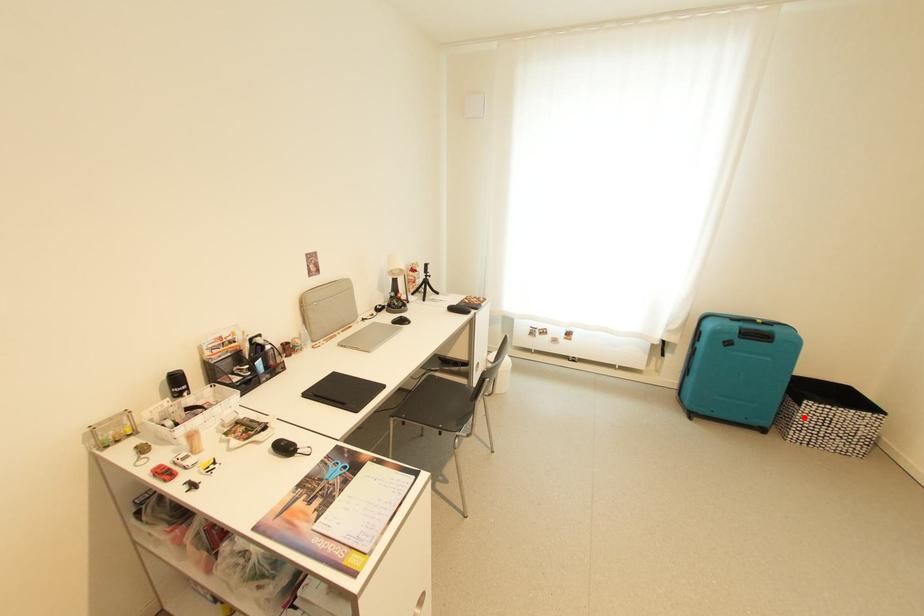
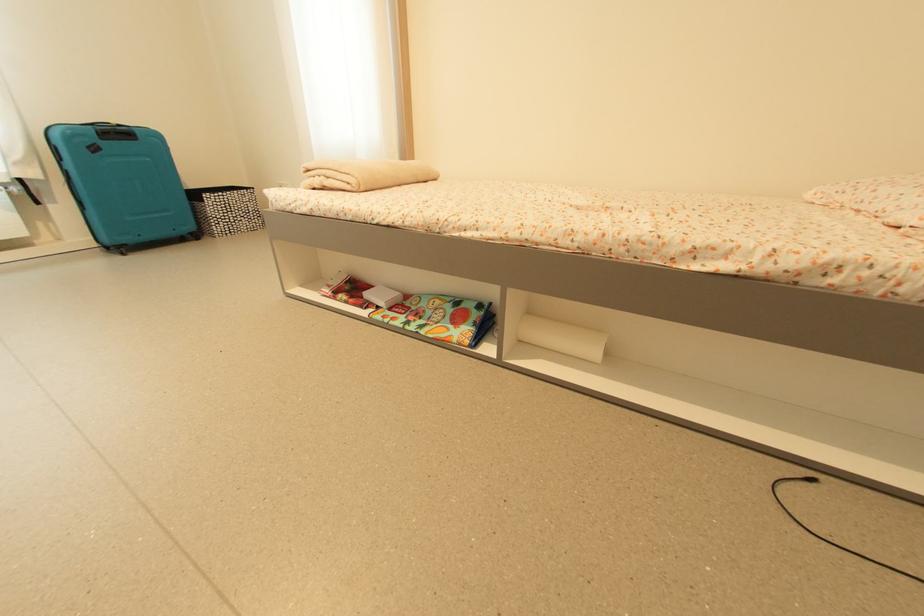
The point at the highlighted location is marked in the first image. Where is the corresponding point in the second image?

(213, 212)